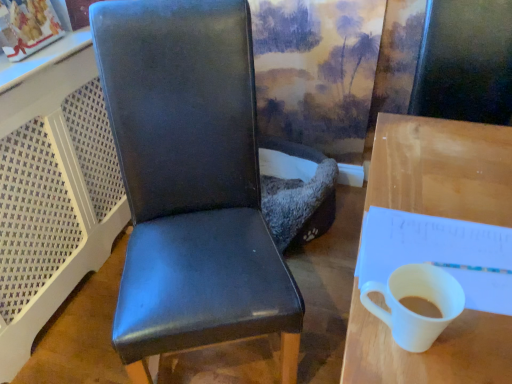
Locate an element on the screen. vacant space in white paper notepad at right (from a real-world perspective) is located at coordinates (449, 249).